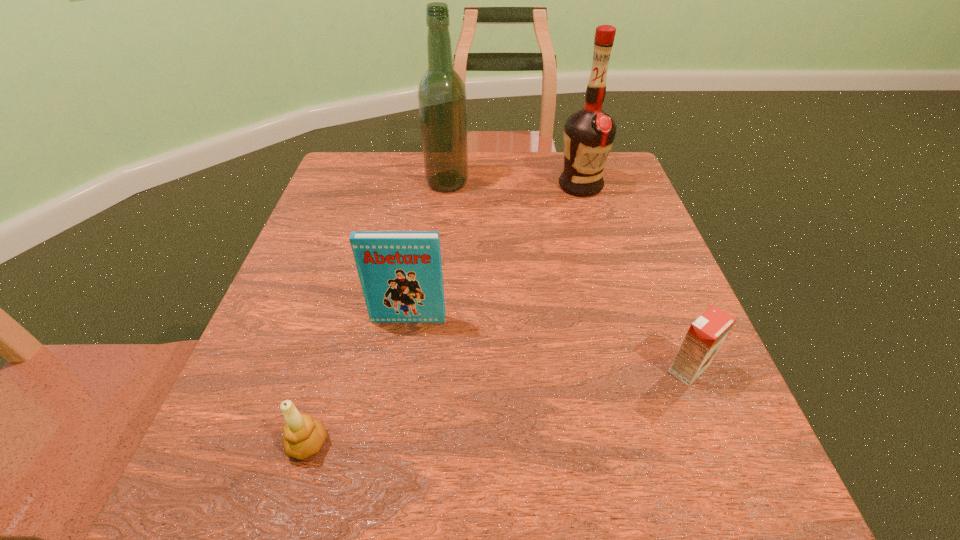
I want to click on vacant space at the right edge of the desktop, so click(x=674, y=319).

At what (x,y) coordinates should I click in order to perform the action: click on free space at the far left corner. Please return your answer as a coordinate pair (x, y). The width and height of the screenshot is (960, 540). Looking at the image, I should click on (336, 178).

The width and height of the screenshot is (960, 540). Identify the location of blank space at the near left corner of the desktop. (272, 494).

At what (x,y) coordinates should I click in order to perform the action: click on free point at the far right corner. Please return your answer as a coordinate pair (x, y). Looking at the image, I should click on (633, 189).

Where is `free space at the near right corner of the desktop`? This screenshot has height=540, width=960. free space at the near right corner of the desktop is located at coordinates (734, 532).

Identify the location of free spot between the right liquor and the orange juice. (635, 278).

Where is `unoccupied area between the right liquor and the orange juice`? unoccupied area between the right liquor and the orange juice is located at coordinates (635, 278).

At what (x,y) coordinates should I click in order to perform the action: click on free space between the nearest object and the third tallest object. Please return your answer as a coordinate pair (x, y). Image resolution: width=960 pixels, height=540 pixels. Looking at the image, I should click on (358, 382).

This screenshot has width=960, height=540. What are the coordinates of `vacant space in between the left liquor and the second nearest object` in the screenshot? It's located at (567, 276).

I want to click on vacant point located between the right liquor and the fourth farthest object, so (635, 278).